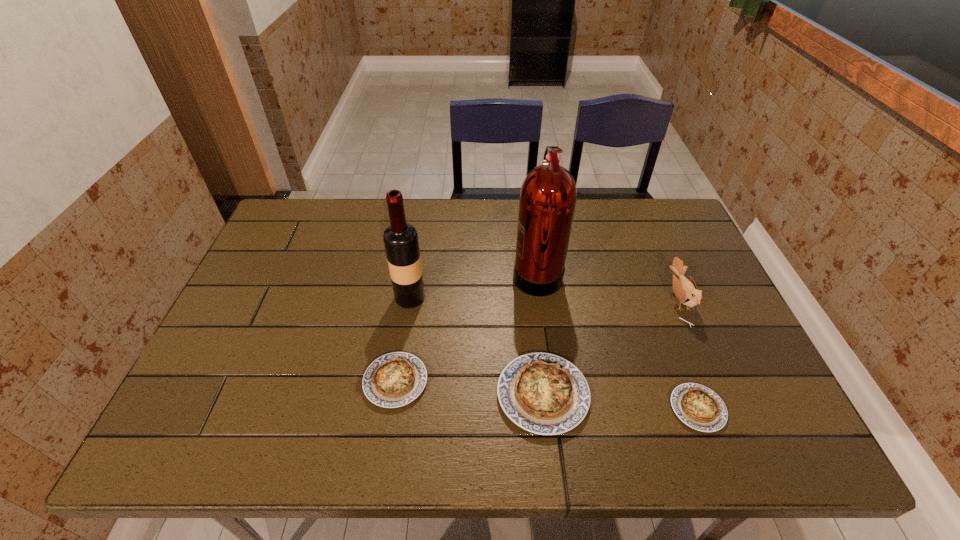
This screenshot has height=540, width=960. Identify the location of free spot that satisfies the following two spatial constraints: 1. on the front-facing side of the fire extinguisher; 2. on the back side of the shortest quiche. (555, 409).

This screenshot has height=540, width=960. Identify the location of free spot that satisfies the following two spatial constraints: 1. on the front side of the shortest quiche; 2. on the right side of the second tallest quiche. (392, 409).